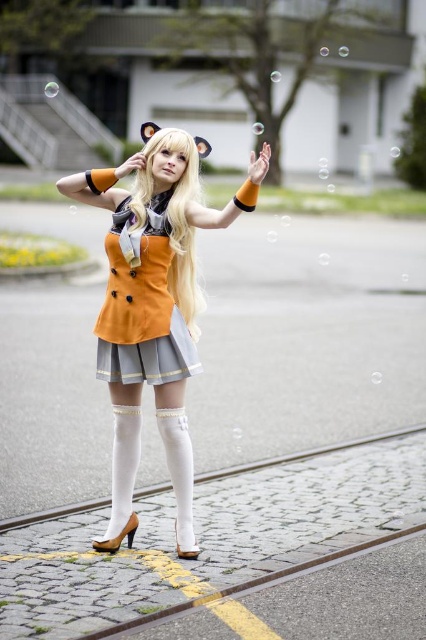
Which is more to the left, orange fabric dress at center or blonde silky hair at center?

Positioned to the left is orange fabric dress at center.

Consider the image. Is orange fabric dress at center taller than blonde silky hair at center?

Yes.

Who is more forward, (108, 547) or (190, 243)?

Point (108, 547)

Find the location of a particular element. Image resolution: width=426 pixels, height=640 pixels. orange fabric dress at center is located at coordinates (152, 307).

Is orange fabric dress at center closer to the viewer compared to orange satin dress at center?

That is True.

Is orange fabric dress at center positioned behind orange satin dress at center?

No, orange fabric dress at center is closer to the viewer.

Locate an element on the screen. The width and height of the screenshot is (426, 640). orange fabric dress at center is located at coordinates (152, 307).

Is orange satin dress at center above blonde silky hair at center?

Actually, orange satin dress at center is below blonde silky hair at center.

At what (x,y) coordinates should I click in order to perform the action: click on orange satin dress at center. Please return your answer as a coordinate pair (x, y). Looking at the image, I should click on (141, 304).

What do you see at coordinates (141, 304) in the screenshot?
I see `orange satin dress at center` at bounding box center [141, 304].

In order to click on orange satin dress at center in this screenshot , I will do `click(141, 304)`.